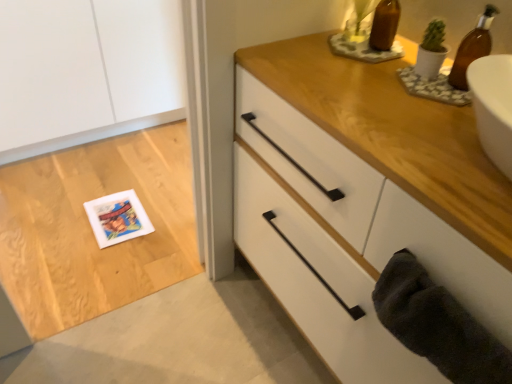
At what (x,y) coordinates should I click in order to perform the action: click on white matte postcard at lower left. Please return your answer as a coordinate pair (x, y). Looking at the image, I should click on (117, 218).

Describe the element at coordinates (117, 218) in the screenshot. The height and width of the screenshot is (384, 512). I see `white matte postcard at lower left` at that location.

The height and width of the screenshot is (384, 512). I want to click on brown glass bottle at upper right, so click(x=384, y=25).

Locate an element on the screen. The image size is (512, 384). white matte chest of drawers at upper right is located at coordinates (362, 201).

Image resolution: width=512 pixels, height=384 pixels. I want to click on white matte postcard at lower left, so click(117, 218).

Would you consider white matte chest of drawers at upper right to be distant from brown glass bottle at upper right?

white matte chest of drawers at upper right is actually quite close to brown glass bottle at upper right.

Looking at this image, considering the sizes of objects white matte chest of drawers at upper right and brown glass bottle at upper right in the image provided, who is thinner, white matte chest of drawers at upper right or brown glass bottle at upper right?

brown glass bottle at upper right is thinner.

Based on the photo, which is more to the right, white matte chest of drawers at upper right or brown glass bottle at upper right?

brown glass bottle at upper right is more to the right.

Is white matte postcard at lower left further to camera compared to dark gray plush bath towel at lower right?

Yes.

Is white matte postcard at lower left facing towards dark gray plush bath towel at lower right?

No.

Choose the correct answer: Is white matte postcard at lower left inside dark gray plush bath towel at lower right or outside it?

The correct answer is: outside.

Is point (145, 223) more distant than point (486, 364)?

Yes.

Is white matte postcard at lower left wider or thinner than brown glass bottle at upper right?

In the image, white matte postcard at lower left appears to be wider than brown glass bottle at upper right.

From a real-world perspective, is white matte postcard at lower left positioned above or below brown glass bottle at upper right?

white matte postcard at lower left is situated lower than brown glass bottle at upper right in the real world.

Is white matte postcard at lower left looking in the opposite direction of brown glass bottle at upper right?

No, brown glass bottle at upper right is not at the back of white matte postcard at lower left.

Based on the photo, can you confirm if white matte postcard at lower left is smaller than brown glass bottle at upper right?

No, white matte postcard at lower left is not smaller than brown glass bottle at upper right.

At what (x,y) coordinates should I click in order to perform the action: click on postcard that is behind the white matte chest of drawers at upper right. Please return your answer as a coordinate pair (x, y). The height and width of the screenshot is (384, 512). Looking at the image, I should click on (117, 218).

From the image's perspective, between white matte postcard at lower left and white matte chest of drawers at upper right, who is located below?

white matte postcard at lower left appears lower in the image.

Is white matte postcard at lower left inside the boundaries of white matte chest of drawers at upper right, or outside?

white matte postcard at lower left is spatially situated outside white matte chest of drawers at upper right.

From a real-world perspective, is brown glass bottle at upper right physically above white matte postcard at lower left?

Yes, from a real-world perspective, brown glass bottle at upper right is on top of white matte postcard at lower left.

What's the angular difference between brown glass bottle at upper right and white matte postcard at lower left's facing directions?

The angle between the facing direction of brown glass bottle at upper right and the facing direction of white matte postcard at lower left is 90.3 degrees.

Does brown glass bottle at upper right have a greater height compared to white matte postcard at lower left?

Yes, brown glass bottle at upper right is taller than white matte postcard at lower left.

Which is in front, brown glass bottle at upper right or white matte postcard at lower left?

Positioned in front is brown glass bottle at upper right.

Looking at this image, can you confirm if brown glass bottle at upper right is shorter than brown glass bottle at upper right?

Yes, brown glass bottle at upper right is shorter than brown glass bottle at upper right.

Is brown glass bottle at upper right inside the boundaries of brown glass bottle at upper right, or outside?

brown glass bottle at upper right is located beyond the bounds of brown glass bottle at upper right.

Which is behind, point (486, 8) or point (375, 17)?

The point (375, 17) is more distant.

Looking at this image, from the image's perspective, is brown glass bottle at upper right on top of brown glass bottle at upper right?

Incorrect, from the image's perspective, brown glass bottle at upper right is lower than brown glass bottle at upper right.

Measure the distance from white matte chest of drawers at upper right to white matte postcard at lower left.

A distance of 36.19 inches exists between white matte chest of drawers at upper right and white matte postcard at lower left.

Locate an element on the screen. The width and height of the screenshot is (512, 384). chest of drawers that appears on the right of white matte postcard at lower left is located at coordinates (362, 201).

From a real-world perspective, which object stands above the other?

From a 3D spatial view, white matte chest of drawers at upper right is above.

Considering the relative sizes of white matte chest of drawers at upper right and white matte postcard at lower left in the image provided, is white matte chest of drawers at upper right wider than white matte postcard at lower left?

Yes.

Locate an element on the screen. the chest of drawers lying in front of the brown glass bottle at upper right is located at coordinates (362, 201).

Identify the location of bath towel on the right side of white matte postcard at lower left. (437, 325).

When comparing their distances from white matte postcard at lower left, does dark gray plush bath towel at lower right or brown glass bottle at upper right seem further?

brown glass bottle at upper right is further to white matte postcard at lower left.

Which object lies further to the anchor point white matte chest of drawers at upper right, white matte postcard at lower left or dark gray plush bath towel at lower right?

white matte postcard at lower left lies further to white matte chest of drawers at upper right than the other object.

Which object lies nearer to the anchor point white matte postcard at lower left, white matte chest of drawers at upper right or brown glass bottle at upper right?

white matte chest of drawers at upper right is positioned closer to the anchor white matte postcard at lower left.

When comparing their distances from white matte postcard at lower left, does brown glass bottle at upper right or dark gray plush bath towel at lower right seem closer?

Based on the image, brown glass bottle at upper right appears to be nearer to white matte postcard at lower left.

Considering their positions, is brown glass bottle at upper right positioned further to dark gray plush bath towel at lower right than white matte chest of drawers at upper right?

Among the two, brown glass bottle at upper right is located further to dark gray plush bath towel at lower right.

Based on the photo, estimate the real-world distances between objects in this image. Which object is closer to white matte chest of drawers at upper right, brown glass bottle at upper right or dark gray plush bath towel at lower right?

dark gray plush bath towel at lower right is positioned closer to the anchor white matte chest of drawers at upper right.

When comparing their distances from brown glass bottle at upper right, does brown glass bottle at upper right or dark gray plush bath towel at lower right seem further?

dark gray plush bath towel at lower right is positioned further to the anchor brown glass bottle at upper right.

From the image, which object appears to be farther from dark gray plush bath towel at lower right, white matte postcard at lower left or brown glass bottle at upper right?

white matte postcard at lower left is further to dark gray plush bath towel at lower right.

Where is `chest of drawers between dark gray plush bath towel at lower right and white matte postcard at lower left along the z-axis`? chest of drawers between dark gray plush bath towel at lower right and white matte postcard at lower left along the z-axis is located at coordinates (362, 201).

Where is `chest of drawers between brown glass bottle at upper right and dark gray plush bath towel at lower right from top to bottom`? Image resolution: width=512 pixels, height=384 pixels. chest of drawers between brown glass bottle at upper right and dark gray plush bath towel at lower right from top to bottom is located at coordinates (362, 201).

At what (x,y) coordinates should I click in order to perform the action: click on the chest of drawers between brown glass bottle at upper right and dark gray plush bath towel at lower right vertically. Please return your answer as a coordinate pair (x, y). Image resolution: width=512 pixels, height=384 pixels. Looking at the image, I should click on (362, 201).

The height and width of the screenshot is (384, 512). I want to click on beer bottle positioned between dark gray plush bath towel at lower right and white matte postcard at lower left from near to far, so click(x=472, y=48).